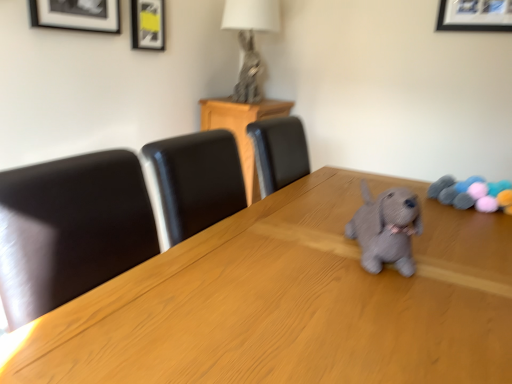
Locate an element on the screen. vacant space to the right of gray knitted dog at center is located at coordinates (456, 255).